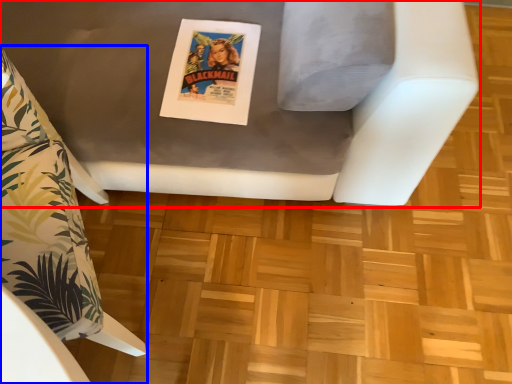
Question: Which object appears farthest to the camera in this image, furniture (highlighted by a red box) or furniture (highlighted by a blue box)?

Choices:
 (A) furniture
 (B) furniture

Answer: (B)